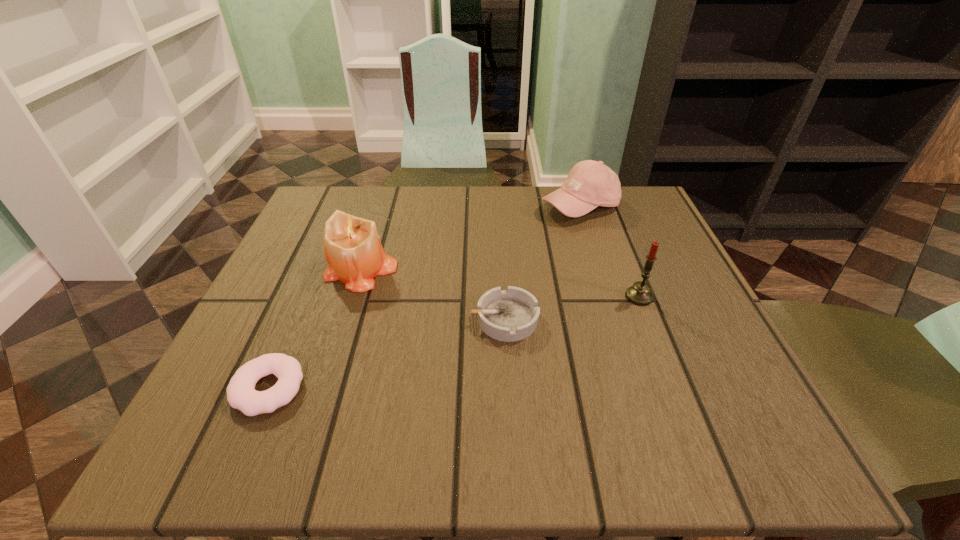
Where is `object positioned at the far right corner`? The height and width of the screenshot is (540, 960). object positioned at the far right corner is located at coordinates (590, 184).

Identify the location of free region at the far edge of the desktop. (569, 231).

Identify the location of free space at the near edge. (573, 433).

Where is `free space at the left edge of the desktop`? The image size is (960, 540). free space at the left edge of the desktop is located at coordinates (323, 300).

The height and width of the screenshot is (540, 960). Identify the location of vacant space at the right edge. (619, 253).

You are a GUI agent. You are given a task and a screenshot of the screen. Output one action in this format:
    pyautogui.click(x=<x>, y=<y>)
    Task: Click on the free space at the far left corner
    The image size is (960, 540).
    Given the screenshot: What is the action you would take?
    pyautogui.click(x=356, y=188)

This screenshot has height=540, width=960. I want to click on vacant space at the far right corner, so click(626, 228).

In order to click on vacant area that lies between the second shortest object and the left candle in this screenshot , I will do `click(432, 295)`.

Where is `free spot between the third object from right to left and the left candle`? The width and height of the screenshot is (960, 540). free spot between the third object from right to left and the left candle is located at coordinates point(432,295).

Locate an element on the screen. Image resolution: width=960 pixels, height=540 pixels. free space between the fourth tallest object and the left candle is located at coordinates click(432, 295).